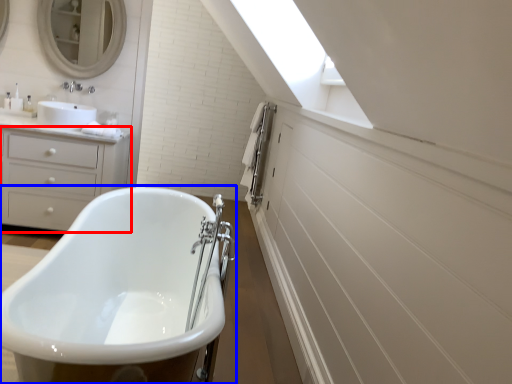
Question: Which object is further to the camera taking this photo, chest of drawers (highlighted by a red box) or bathtub (highlighted by a blue box)?

Choices:
 (A) chest of drawers
 (B) bathtub

Answer: (A)